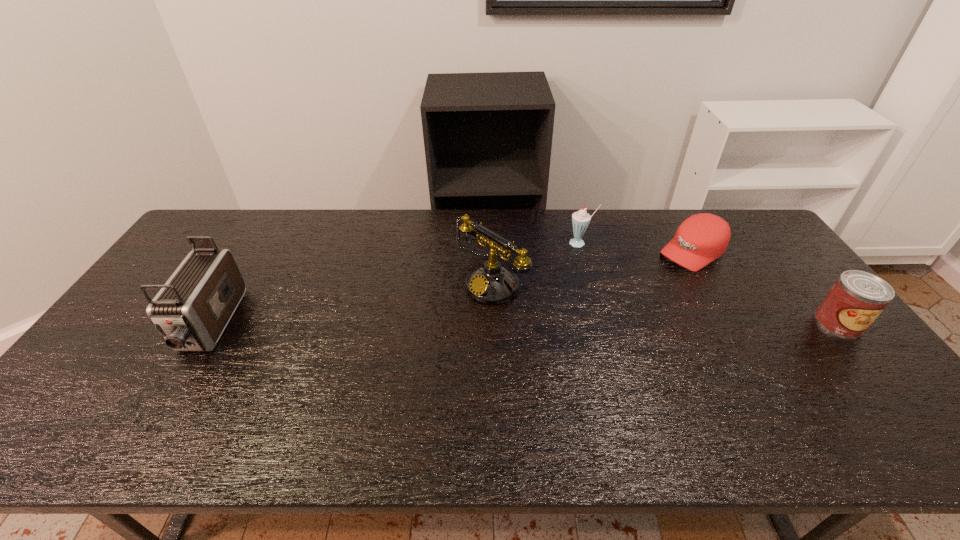
The width and height of the screenshot is (960, 540). I want to click on free space that satisfies the following two spatial constraints: 1. on the back side of the milkshake; 2. on the left side of the telephone, so [490, 243].